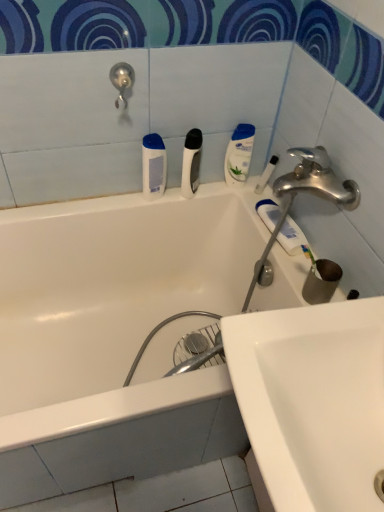
Find the location of a particular element. The image size is (384, 512). free location to the right of white matte razor at center, the 2th toiletry when ordered from left to right is located at coordinates (239, 193).